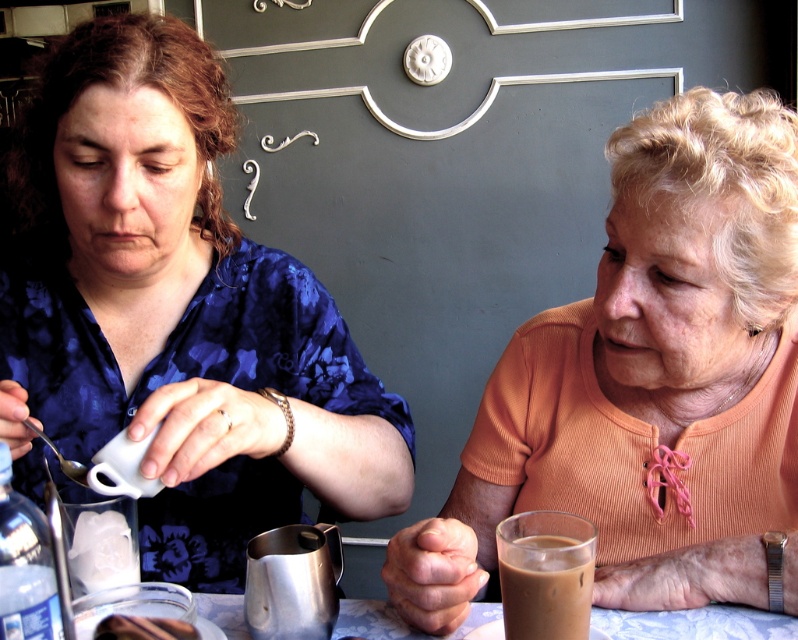
Between matte blue blouse at upper left and shiny metallic pitcher at lower center, which one appears on the right side from the viewer's perspective?

shiny metallic pitcher at lower center is more to the right.

Is point (295, 515) farther from viewer compared to point (259, 563)?

Yes, point (295, 515) is farther from viewer.

Image resolution: width=798 pixels, height=640 pixels. Find the location of `matte blue blouse at upper left`. matte blue blouse at upper left is located at coordinates (176, 314).

Is brown frothy beverage at lower center below smooth chocolate bar at lower left?

Incorrect, brown frothy beverage at lower center is not positioned below smooth chocolate bar at lower left.

Which is below, brown frothy beverage at lower center or smooth chocolate bar at lower left?

smooth chocolate bar at lower left is below.

Between point (565, 595) and point (180, 625), which one is positioned in front?

Point (565, 595) is in front.

At what (x,y) coordinates should I click in order to perform the action: click on brown frothy beverage at lower center. Please return your answer as a coordinate pair (x, y). Looking at the image, I should click on (544, 602).

Does matte orange blouse at right have a lesser height compared to metallic silver pitcher at lower center?

Incorrect, matte orange blouse at right's height does not fall short of metallic silver pitcher at lower center's.

Between matte orange blouse at right and metallic silver pitcher at lower center, which one is positioned lower?

metallic silver pitcher at lower center is below.

The height and width of the screenshot is (640, 798). I want to click on matte orange blouse at right, so click(x=650, y=385).

Locate an element on the screen. The height and width of the screenshot is (640, 798). matte orange blouse at right is located at coordinates [x=650, y=385].